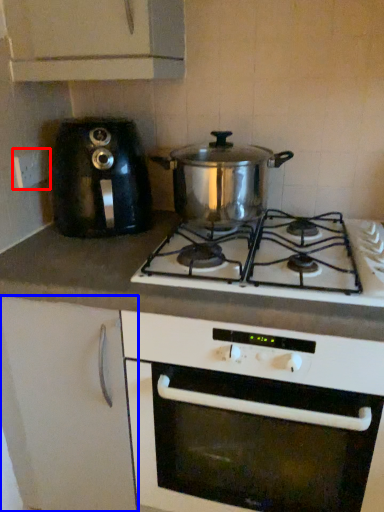
Question: Among these objects, which one is farthest to the camera, electric outlet (highlighted by a red box) or cabinetry (highlighted by a blue box)?

Choices:
 (A) electric outlet
 (B) cabinetry

Answer: (A)